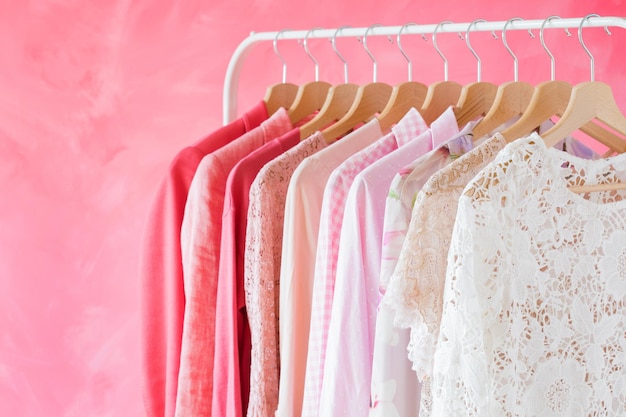
You are a GUI agent. You are given a task and a screenshot of the screen. Output one action in this format:
    pyautogui.click(x=<x>, y=<y>)
    Task: Click on the garments on wooden clothes hangers
    
    Given the screenshot: What is the action you would take?
    pyautogui.click(x=215, y=134), pyautogui.click(x=257, y=133), pyautogui.click(x=280, y=140), pyautogui.click(x=300, y=146), pyautogui.click(x=337, y=146), pyautogui.click(x=369, y=154), pyautogui.click(x=393, y=156), pyautogui.click(x=433, y=160), pyautogui.click(x=467, y=167), pyautogui.click(x=508, y=167)